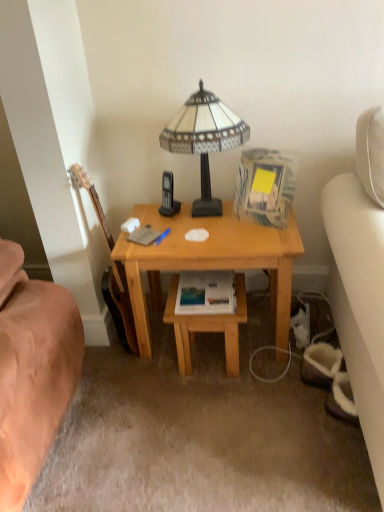
Locate an element on the screen. This screenshot has height=512, width=384. vacant space to the right of light brown wood table at center is located at coordinates (272, 344).